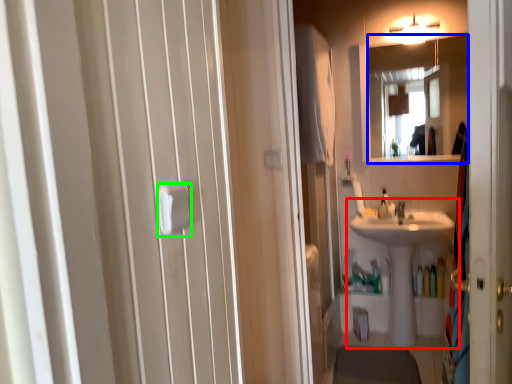
Question: Estimate the real-world distances between objects in this image. Which object is closer to sink (highlighted by a red box), mirror (highlighted by a blue box) or towel bar (highlighted by a green box)?

Choices:
 (A) mirror
 (B) towel bar

Answer: (A)